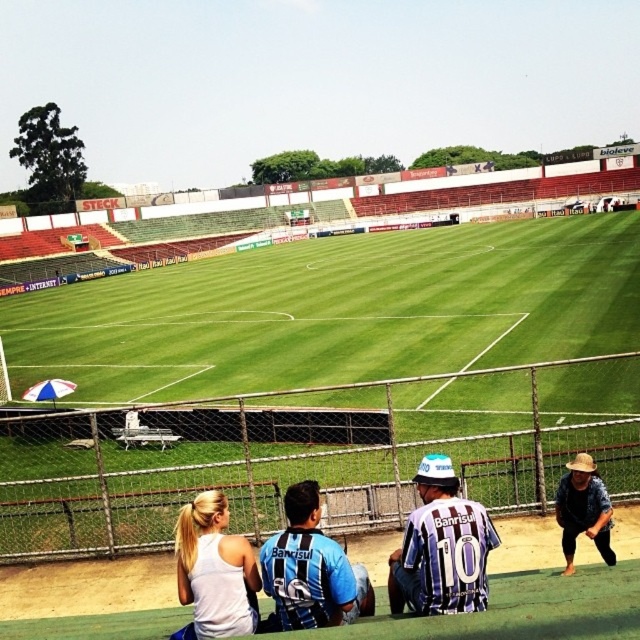
Is the position of blue jersey at center less distant than that of white matte tank top at lower center?

Yes, it is.

Between point (289, 490) and point (205, 592), which one is positioned behind?

The point (289, 490) is more distant.

Is point (321, 563) in front of point (218, 522)?

Yes, it is.

Find the location of `blue jersey at center`. blue jersey at center is located at coordinates (307, 568).

What are the coordinates of `blue jersey at center` in the screenshot? It's located at (307, 568).

Is blue jersey at center to the left of brown woven hat at lower right from the viewer's perspective?

Indeed, blue jersey at center is positioned on the left side of brown woven hat at lower right.

Which is in front, point (301, 524) or point (604, 522)?

Point (301, 524)

This screenshot has height=640, width=640. Identify the location of blue jersey at center. (307, 568).

Is purple striped jersey at center wider than blue jersey at center?

In fact, purple striped jersey at center might be narrower than blue jersey at center.

Does point (410, 593) come farther from viewer compared to point (326, 592)?

That is True.

The height and width of the screenshot is (640, 640). In order to click on purple striped jersey at center in this screenshot , I will do `click(442, 547)`.